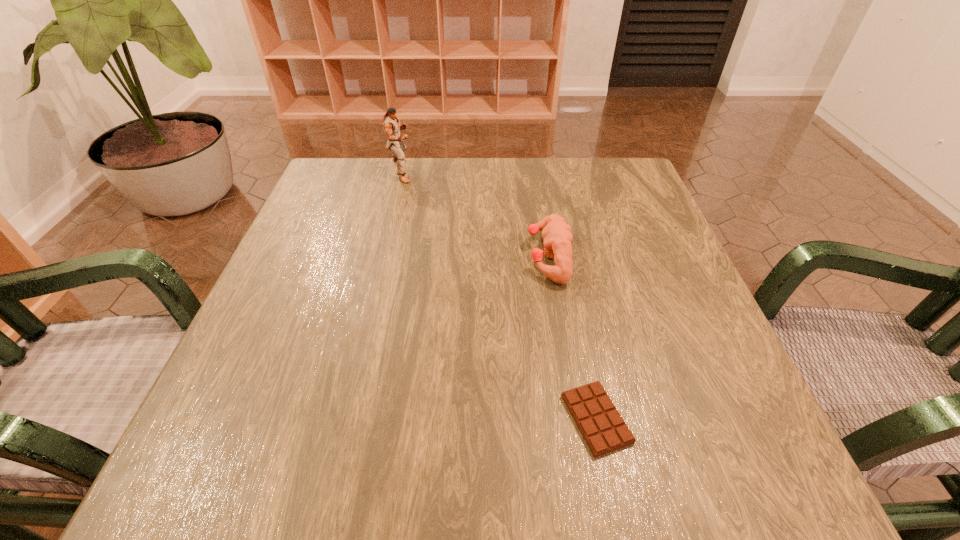
Select which object appears as the second closest to the left puncher. Please provide its 2D coordinates. Your answer should be formatted as a tuple, i.e. [(x, y)], where the tuple contains the x and y coordinates of a point satisfying the conditions above.

[(604, 430)]

Locate an element on the screen. free space that satisfies the following two spatial constraints: 1. with the gloves of the nearer puncher facing forward; 2. on the right side of the candy bar is located at coordinates (575, 419).

The width and height of the screenshot is (960, 540). Identify the location of vacant region that satisfies the following two spatial constraints: 1. with the gloves of the nearer puncher facing forward; 2. on the back side of the nearest object. (575, 419).

Where is `vacant space that satisfies the following two spatial constraints: 1. with the gloves of the nearer puncher facing forward; 2. on the right side of the nearest object`? Image resolution: width=960 pixels, height=540 pixels. vacant space that satisfies the following two spatial constraints: 1. with the gloves of the nearer puncher facing forward; 2. on the right side of the nearest object is located at coordinates (575, 419).

This screenshot has height=540, width=960. In order to click on vacant space that satisfies the following two spatial constraints: 1. with the gloves of the right puncher facing forward; 2. on the right side of the shortest object in this screenshot , I will do `click(575, 419)`.

At what (x,y) coordinates should I click in order to perform the action: click on blank area in the image that satisfies the following two spatial constraints: 1. with the gloves of the shorter puncher facing forward; 2. on the left side of the nearest object. Please return your answer as a coordinate pair (x, y). Looking at the image, I should click on (575, 419).

Locate an element on the screen. This screenshot has height=540, width=960. free space that satisfies the following two spatial constraints: 1. with the gloves of the shortest object facing forward; 2. on the right side of the second tallest object is located at coordinates (575, 419).

Locate an element on the screen. vacant space that satisfies the following two spatial constraints: 1. on the front-facing side of the shortest object; 2. on the left side of the tallest object is located at coordinates (341, 419).

Locate an element on the screen. free space that satisfies the following two spatial constraints: 1. on the front-facing side of the tallest object; 2. on the right side of the shortest object is located at coordinates (341, 419).